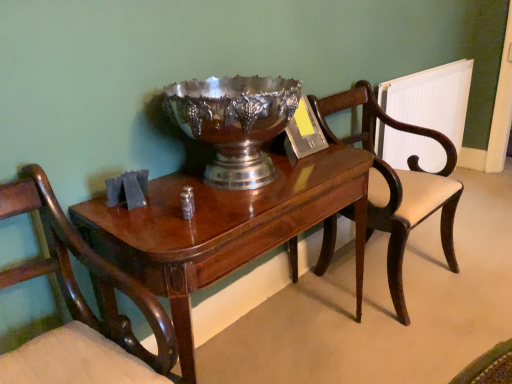
Where is `vacant space that's between mahogany wood table at center and mahogany wood chair at right, the 1th chair from the back`? The image size is (512, 384). vacant space that's between mahogany wood table at center and mahogany wood chair at right, the 1th chair from the back is located at coordinates (355, 338).